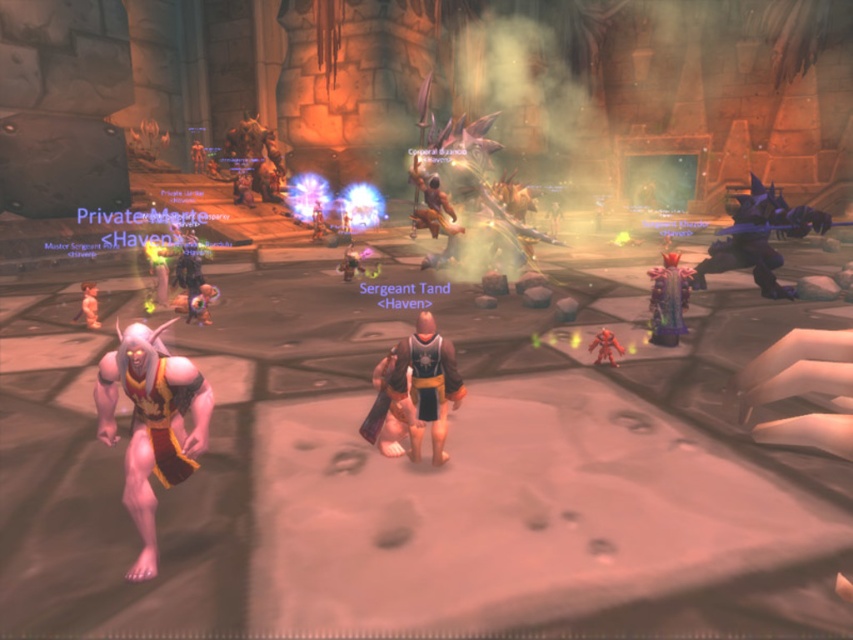
You are a character in this MMORPG dungeon. You see the shiny blue armor at right and the shiny plastic toy at center. Which item should you pick up first if you want to collect the larger item first?

The shiny blue armor at right is bigger than the shiny plastic toy at center, so you should pick up the shiny blue armor at right first.